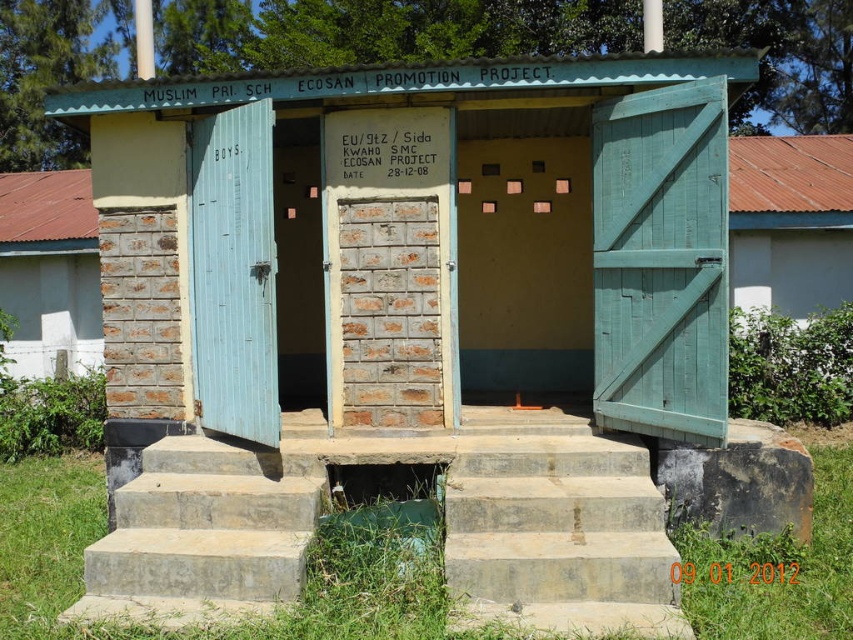
Question: Can you confirm if concrete/steps at center is positioned to the left of green grass at lower right?

Choices:
 (A) yes
 (B) no

Answer: (A)

Question: Can you confirm if concrete/steps at lower center is wider than green grass at lower right?

Choices:
 (A) no
 (B) yes

Answer: (A)

Question: Which point appears closest to the camera in this image?

Choices:
 (A) (737, 614)
 (B) (309, 445)
 (C) (96, 484)
 (D) (73, 280)

Answer: (A)

Question: Can you confirm if green grass at lower center is smaller than white smooth wall at upper right?

Choices:
 (A) yes
 (B) no

Answer: (A)

Question: Which of the following is the closest to the observer?

Choices:
 (A) (735, 586)
 (B) (759, 292)
 (C) (271, 484)

Answer: (A)

Question: Which object is farther from the camera taking this photo?

Choices:
 (A) brick wall at left
 (B) white smooth wall at upper right
 (C) green grass at lower center

Answer: (A)